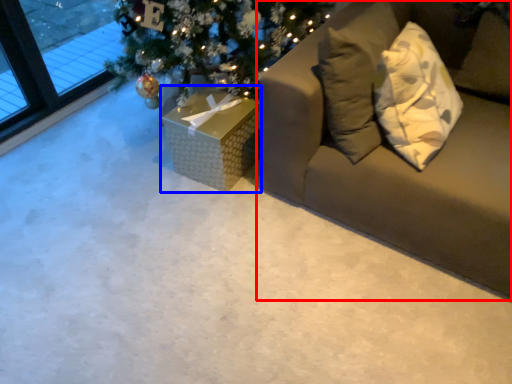
Question: Among these objects, which one is farthest to the camera, studio couch (highlighted by a red box) or furniture (highlighted by a blue box)?

Choices:
 (A) studio couch
 (B) furniture

Answer: (B)